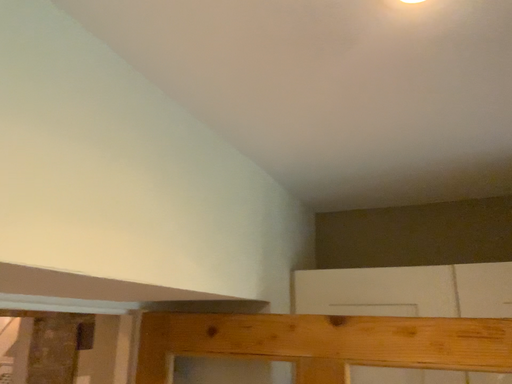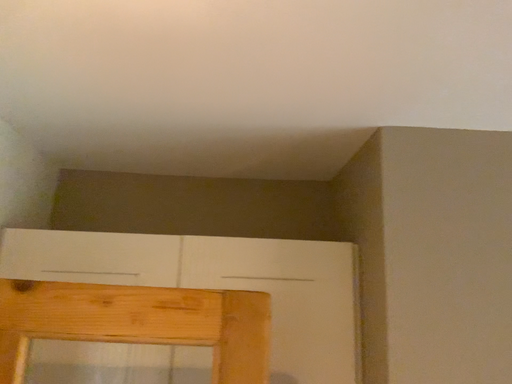
Question: Which way did the camera rotate in the video?

Choices:
 (A) rotated left
 (B) rotated right

Answer: (B)